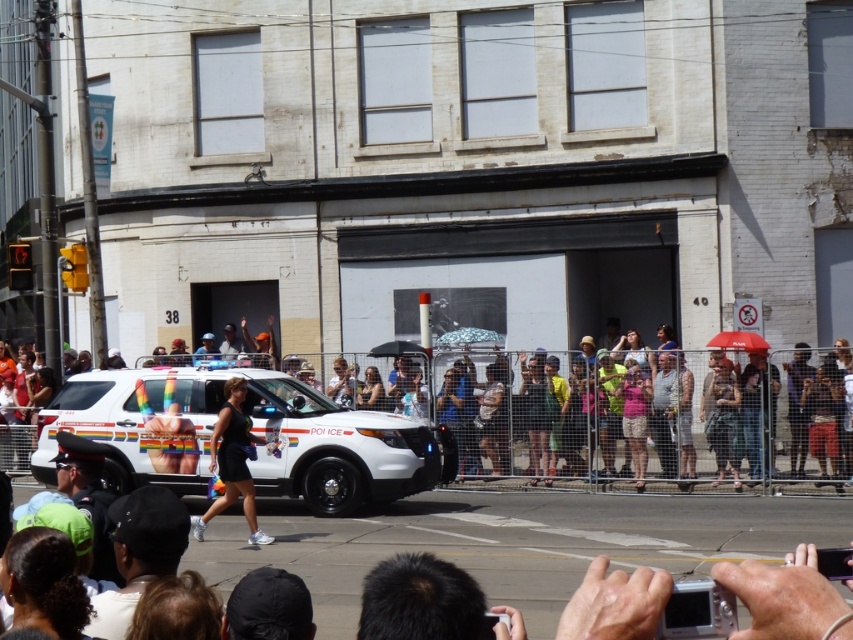
Question: Can you confirm if matte white crowd at center is positioned above black matte dress at center?

Choices:
 (A) yes
 (B) no

Answer: (A)

Question: Which of the following is the farthest from the observer?

Choices:
 (A) (254, 520)
 (B) (750, 472)
 (C) (270, 468)

Answer: (B)

Question: Among these objects, which one is nearest to the camera?

Choices:
 (A) matte white crowd at center
 (B) black matte dress at center

Answer: (B)

Question: Can you confirm if matte white crowd at center is wider than white glossy police car at center?

Choices:
 (A) no
 (B) yes

Answer: (B)

Question: Does matte white crowd at center have a larger size compared to white glossy police car at center?

Choices:
 (A) yes
 (B) no

Answer: (A)

Question: Considering the real-world distances, which object is farthest from the matte white crowd at center?

Choices:
 (A) black matte dress at center
 (B) white glossy police car at center

Answer: (A)